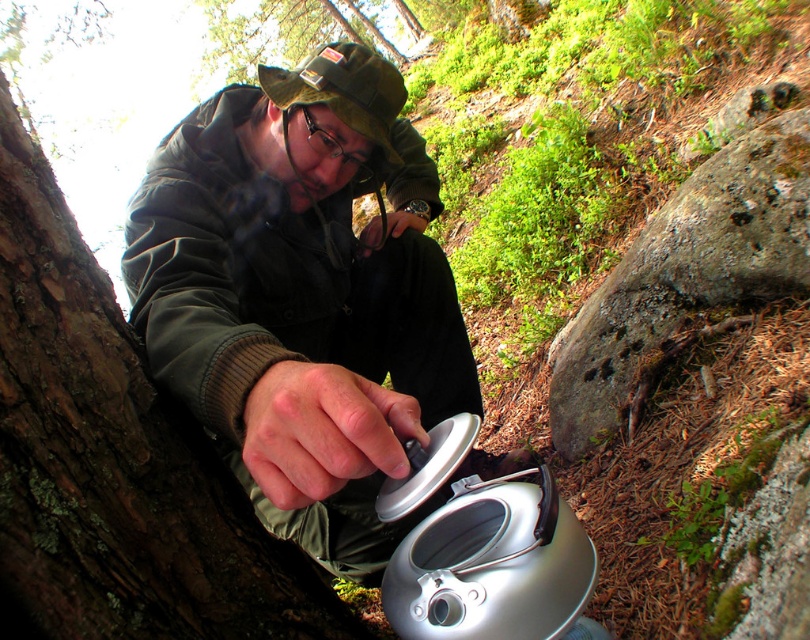
Question: Is matte black jacket at center further to camera compared to brown rough bark at left?

Choices:
 (A) no
 (B) yes

Answer: (A)

Question: Which point is closer to the camera?

Choices:
 (A) matte black jacket at center
 (B) brown rough bark at left

Answer: (A)

Question: Is matte black jacket at center above brown rough bark at left?

Choices:
 (A) no
 (B) yes

Answer: (B)

Question: Can you confirm if matte black jacket at center is thinner than brown rough bark at left?

Choices:
 (A) no
 (B) yes

Answer: (A)

Question: Which object is closer to the camera taking this photo?

Choices:
 (A) matte black jacket at center
 (B) brown rough bark at left

Answer: (A)